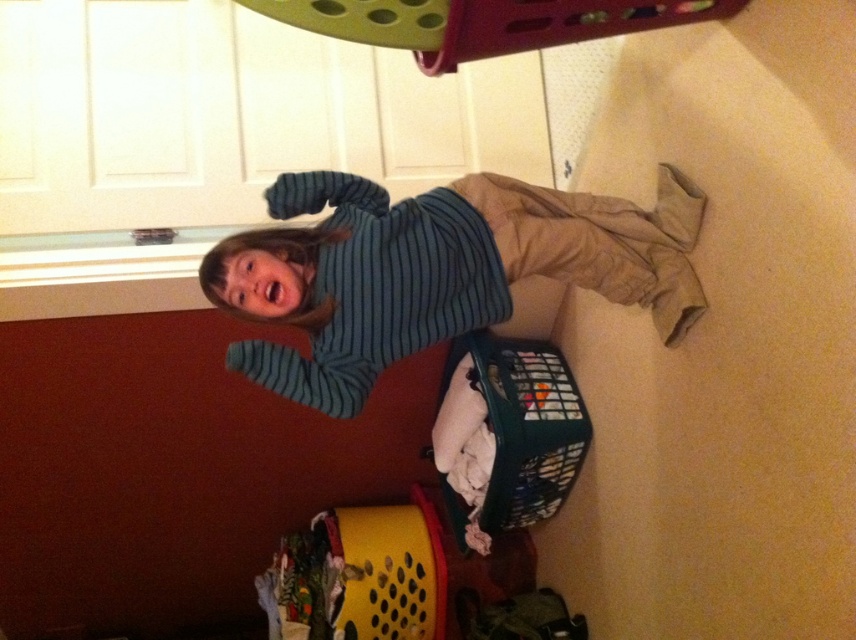
Who is shorter, striped cotton shirt at center or plastic laundry basket at lower right?

With less height is striped cotton shirt at center.

Does point (396, 352) come farther from viewer compared to point (496, 464)?

No, (396, 352) is closer to viewer.

Where is `striped cotton shirt at center`? The width and height of the screenshot is (856, 640). striped cotton shirt at center is located at coordinates (437, 269).